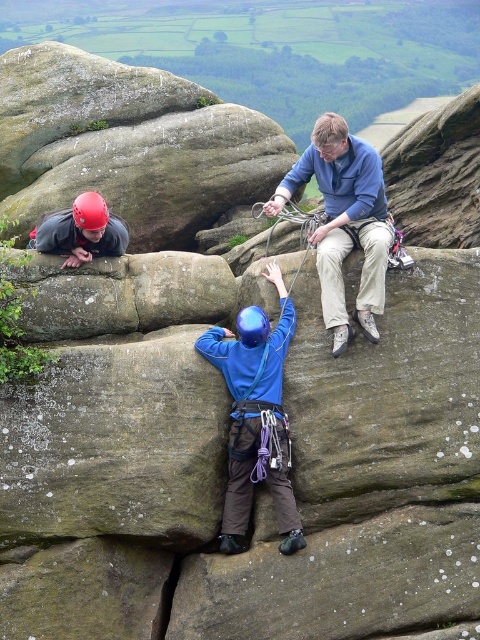
Is point (219, 349) farther from camera compared to point (100, 244)?

No.

Locate an element on the screen. blue fabric helmet at center is located at coordinates (254, 416).

The width and height of the screenshot is (480, 640). I want to click on blue fabric helmet at center, so click(x=254, y=416).